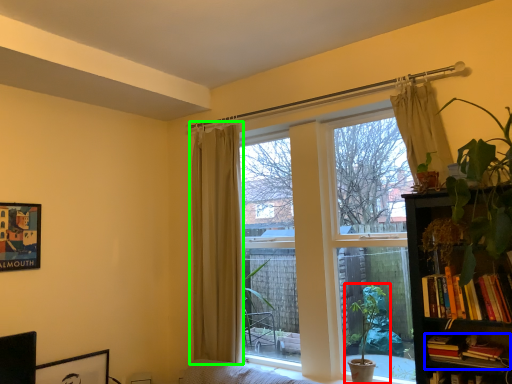
Question: Estimate the real-world distances between objects in this image. Which object is farther from houseplant (highlighted by a red box), book (highlighted by a blue box) or curtain (highlighted by a green box)?

Choices:
 (A) book
 (B) curtain

Answer: (B)